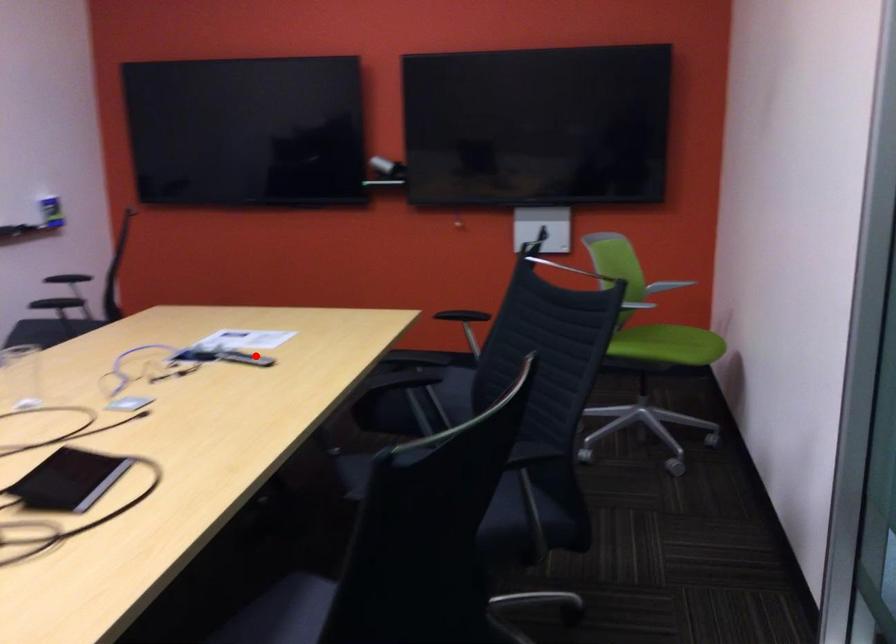
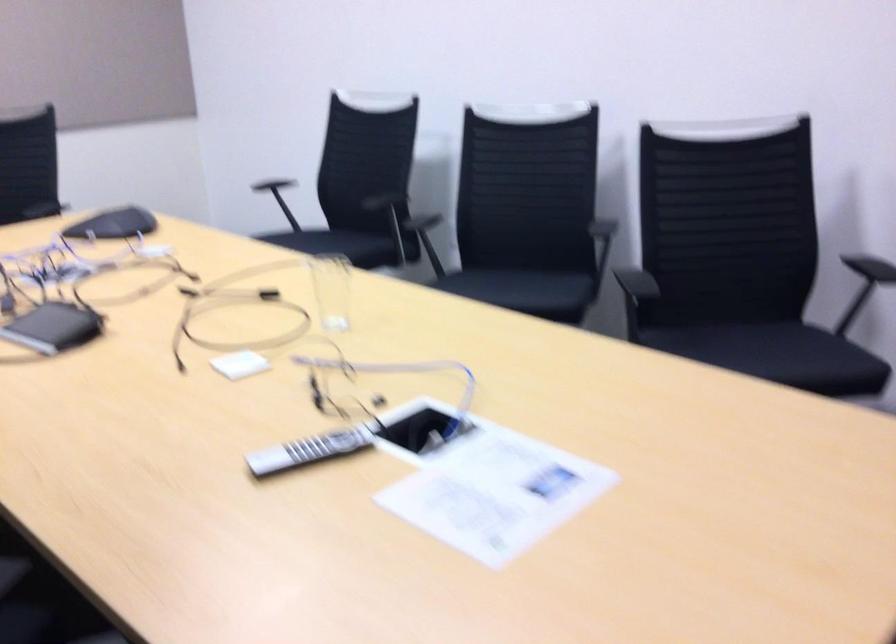
Where in the second image is the point corresponding to the highlighted location from the first image?

(308, 450)